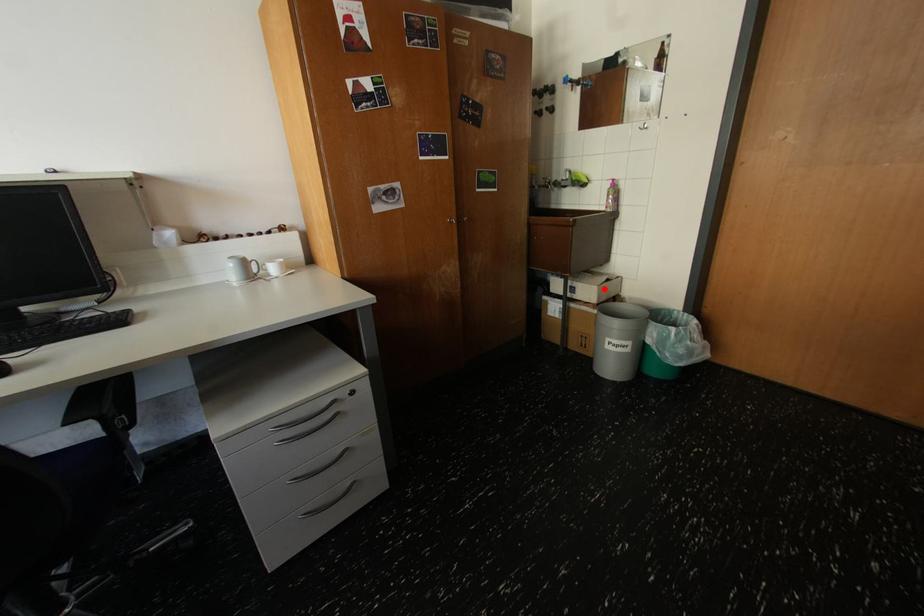
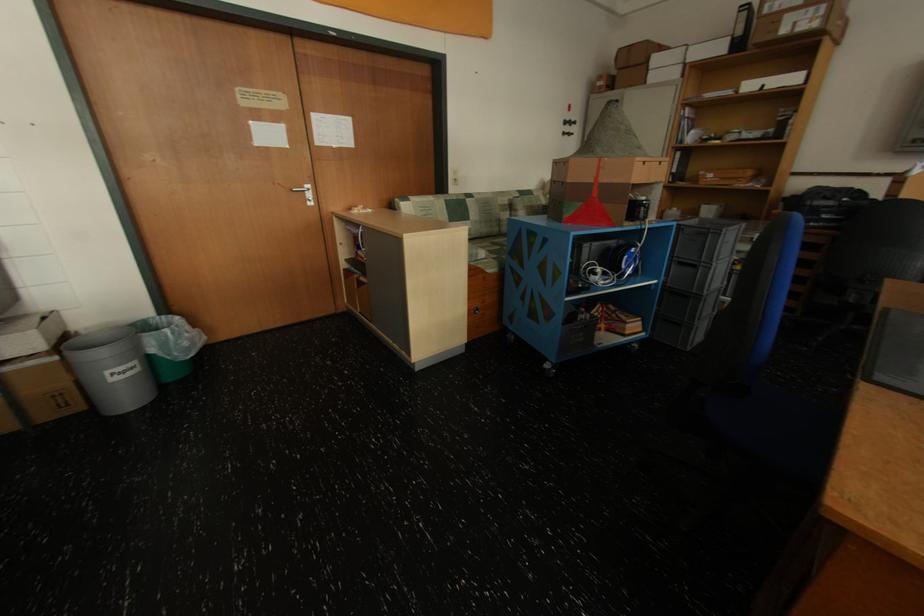
Find the pixel in the second image that matches the highlighted location in the first image.

(43, 333)